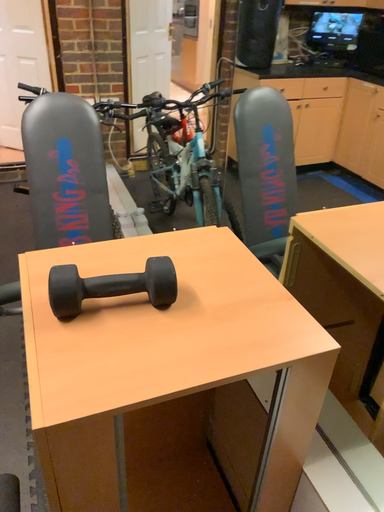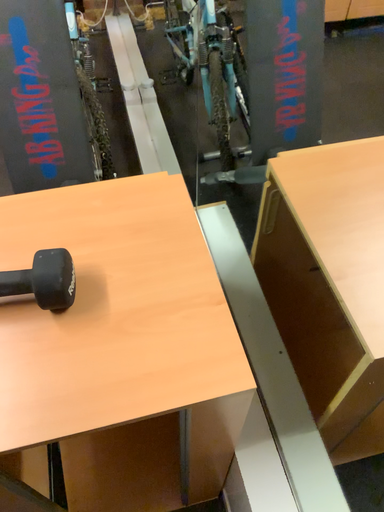
Question: How did the camera likely rotate when shooting the video?

Choices:
 (A) rotated right
 (B) rotated left

Answer: (B)